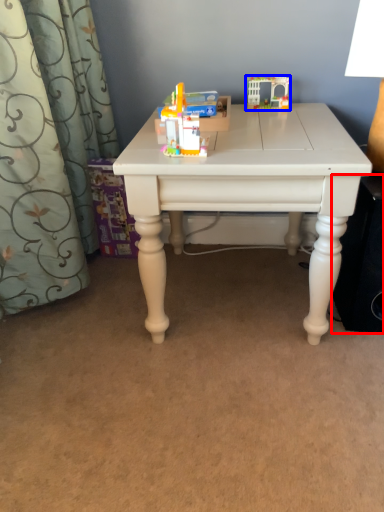
Question: Which object appears closest to the camera in this image, speaker (highlighted by a red box) or toy (highlighted by a blue box)?

Choices:
 (A) speaker
 (B) toy

Answer: (A)